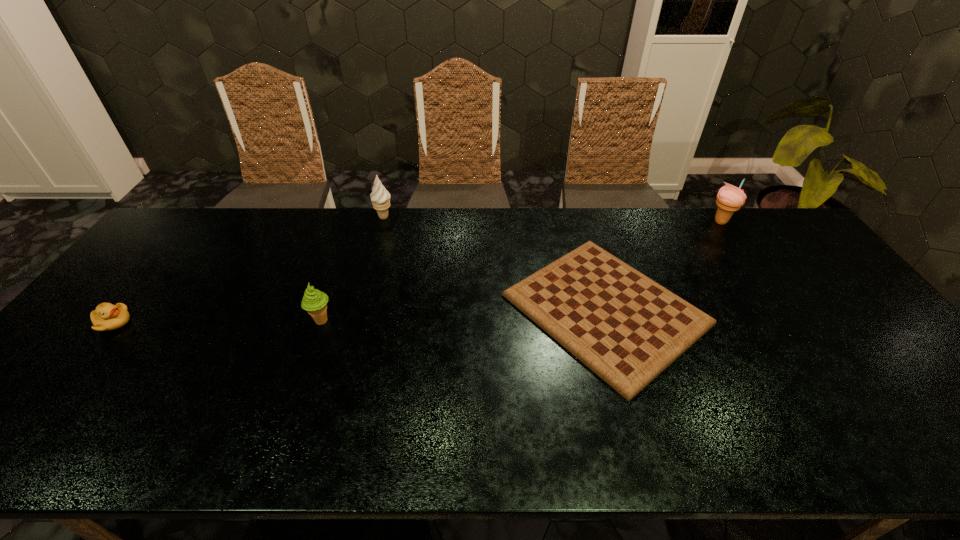
What are the coordinates of `object that is the third closest to the leftmost object` in the screenshot? It's located at point(625,327).

You are a GUI agent. You are given a task and a screenshot of the screen. Output one action in this format:
    pyautogui.click(x=<x>, y=<y>)
    Task: Click on the icecream that stands as the closest to the duckling
    The image size is (960, 540).
    Given the screenshot: What is the action you would take?
    pyautogui.click(x=314, y=301)

Locate which icecream is the closest to the fourth tallest object. Please provide its 2D coordinates. Your answer should be formatted as a tuple, i.e. [(x, y)], where the tuple contains the x and y coordinates of a point satisfying the conditions above.

[(314, 301)]

The image size is (960, 540). I want to click on blank space that satisfies the following two spatial constraints: 1. on the front side of the rightmost object; 2. on the front-facing side of the leftmost object, so click(789, 323).

This screenshot has height=540, width=960. I want to click on vacant space that satisfies the following two spatial constraints: 1. on the front-facing side of the gameboard; 2. on the left side of the third object from left to right, so click(x=358, y=309).

I want to click on vacant area that satisfies the following two spatial constraints: 1. on the front-facing side of the rightmost object; 2. on the left side of the third object from left to right, so click(x=382, y=221).

In order to click on free region that satisfies the following two spatial constraints: 1. on the front-facing side of the third object from right to left; 2. on the front side of the fourth object from right to left in this screenshot , I will do `click(355, 321)`.